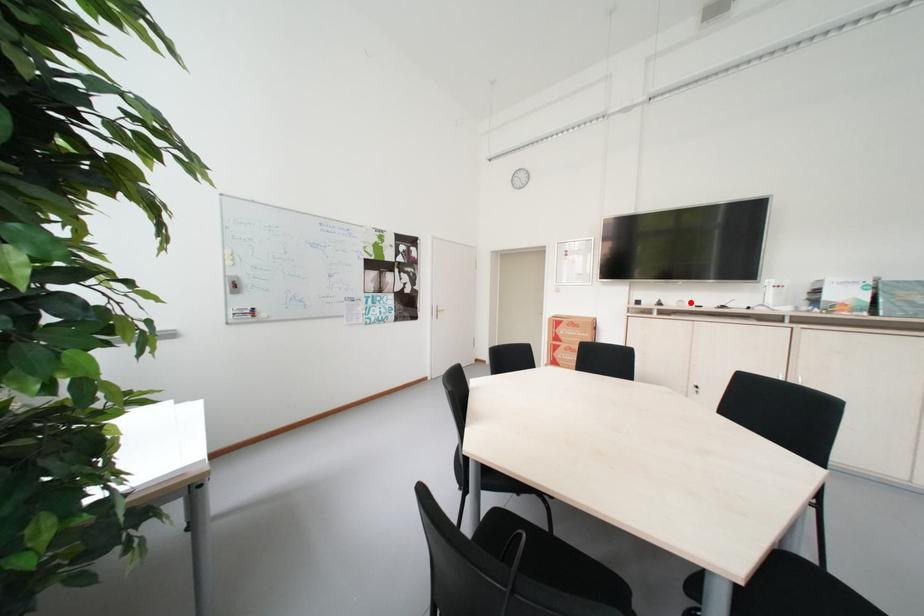
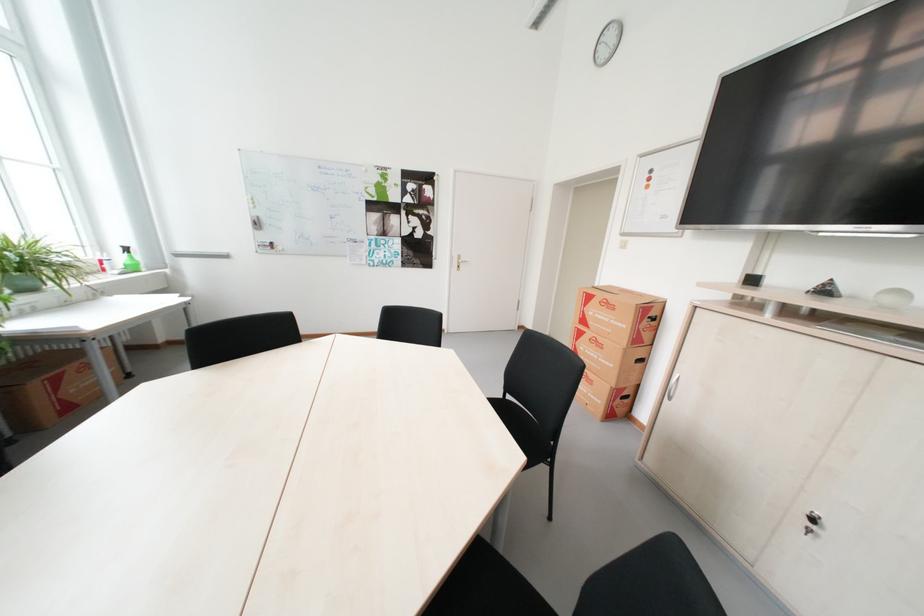
Locate, in the second image, the point that corresponds to the highlighted location in the first image.

(910, 294)